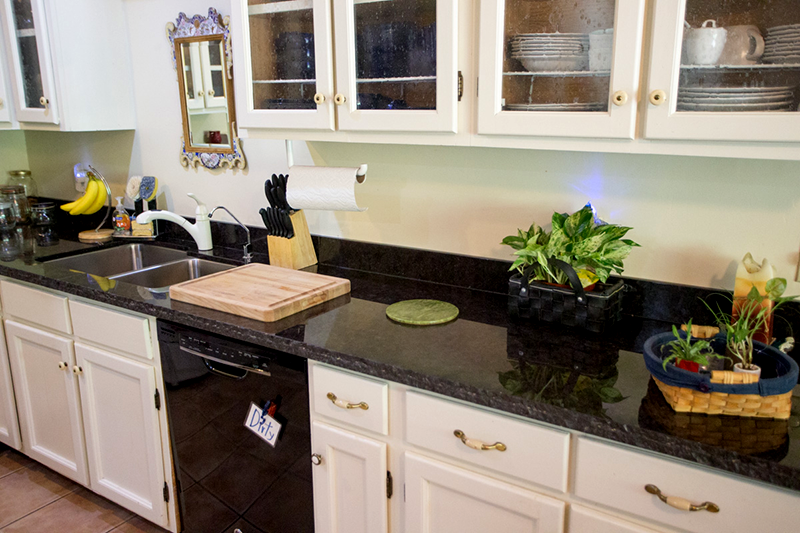
At what (x,y) coordinates should I click in order to perform the action: click on basket. Please return your answer as a coordinate pair (x, y). Looking at the image, I should click on [734, 395].